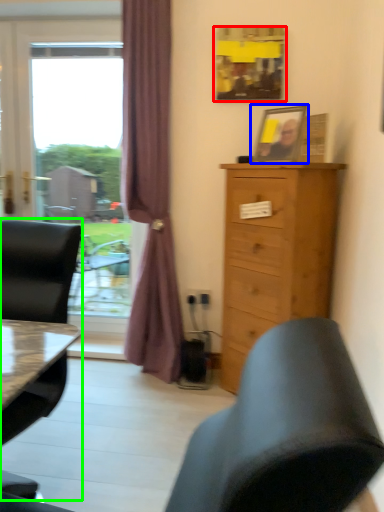
Question: Which object is the closest to the picture frame (highlighted by a red box)? Choose among these: picture frame (highlighted by a blue box) or chair (highlighted by a green box).

Choices:
 (A) picture frame
 (B) chair

Answer: (A)